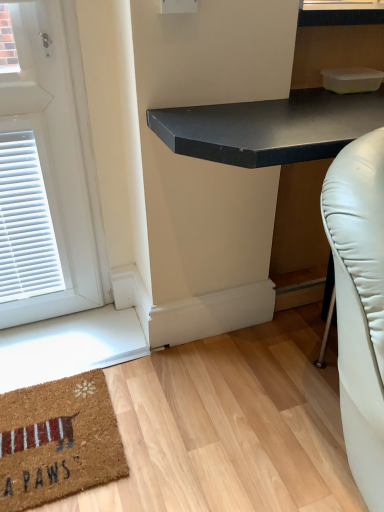
Where is `free point below black matte desk at center (from a real-world perspective)`? The height and width of the screenshot is (512, 384). free point below black matte desk at center (from a real-world perspective) is located at coordinates pos(274,345).